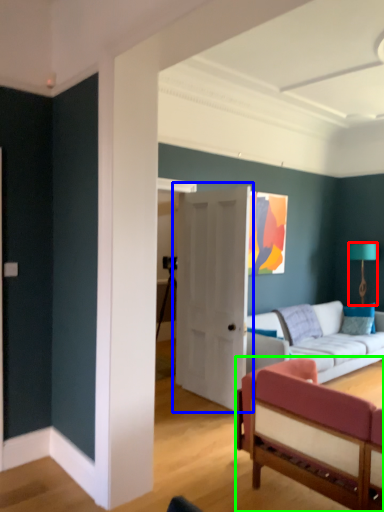
Question: Which object is the closest to the lamp (highlighted by a red box)? Choose among these: door (highlighted by a blue box) or studio couch (highlighted by a green box).

Choices:
 (A) door
 (B) studio couch

Answer: (A)